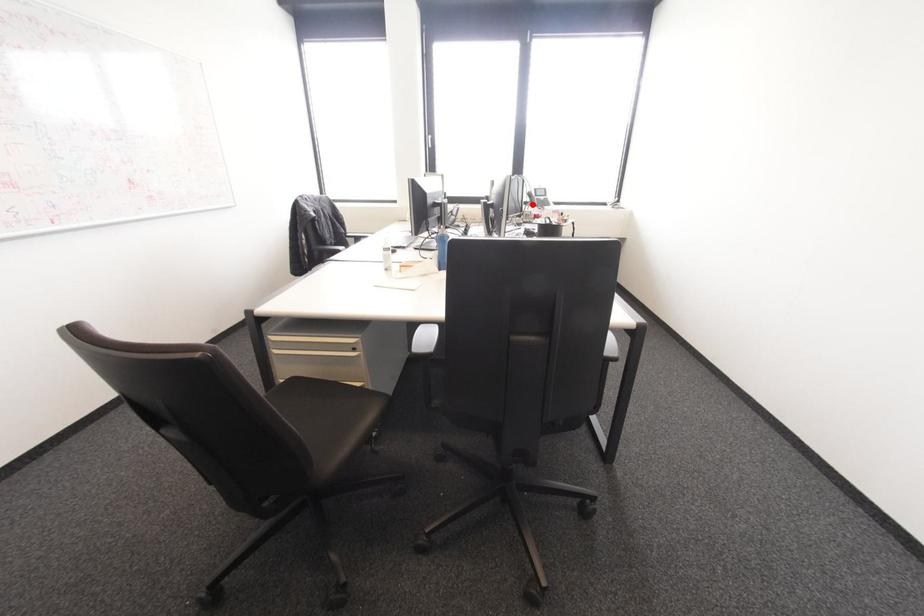
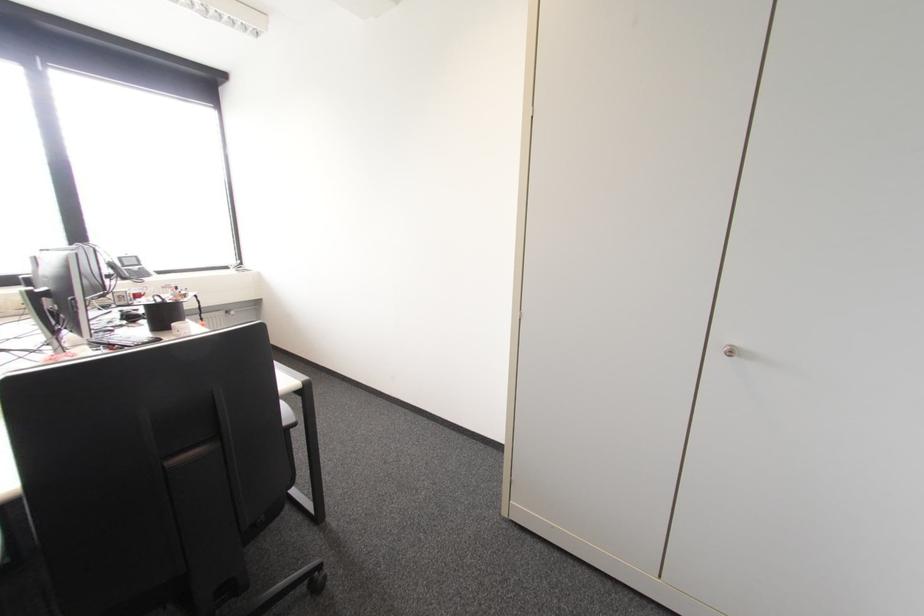
The point at the highlighted location is marked in the first image. Where is the corresponding point in the second image?

(123, 278)